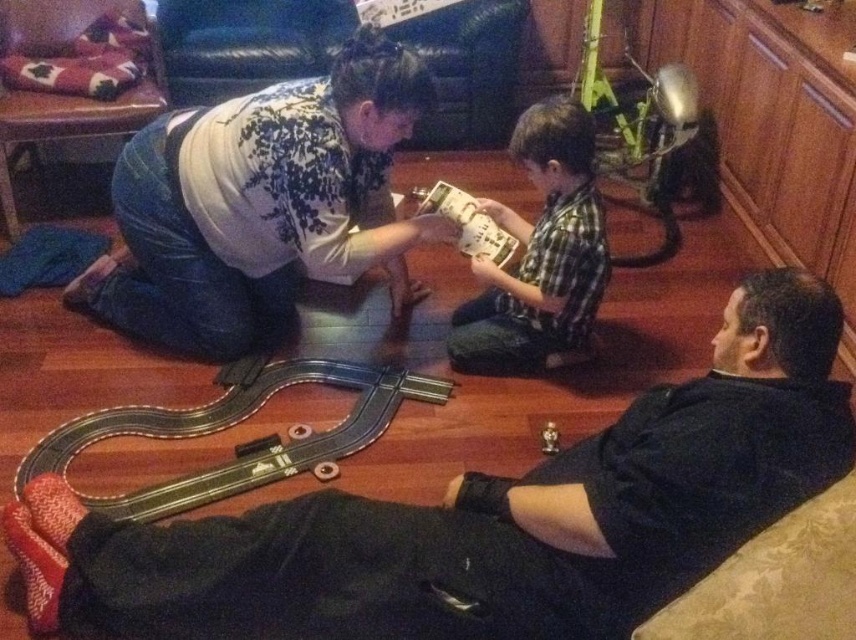
You are a delivery person entering the room and need to place a package between the black matte couch at lower right and the green plaid shirt at center. Can you fit the package there?

The black matte couch at lower right is positioned on the left side of the green plaid shirt at center, so there is space between them to place the package.

You are a photographer trying to capture a candid shot of the dark gray pants at center and the green plaid shirt at center. To ensure both are in focus, you need to know their vertical positions. Which one is positioned lower in the image?

The dark gray pants at center is located below green plaid shirt at center, so it is positioned lower in the image.